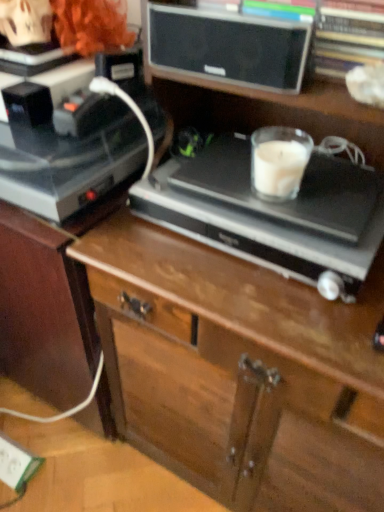
Question: From the image's perspective, is wooden chest of drawers at center above or below shiny black record player at left, which is the second appliance from right to left?

Choices:
 (A) below
 (B) above

Answer: (A)

Question: Relative to shiny black record player at left, which is the second appliance from right to left, is wooden chest of drawers at center in front or behind?

Choices:
 (A) front
 (B) behind

Answer: (A)

Question: Which object is positioned farthest from the white plastic electric outlet at lower left?

Choices:
 (A) satin black record player at center, positioned as the second appliance in left-to-right order
 (B) shiny black record player at left, the 1th appliance viewed from the left
 (C) wooden chest of drawers at center
 (D) matte black speaker at upper center

Answer: (D)

Question: Estimate the real-world distances between objects in this image. Which object is farther from the white plastic electric outlet at lower left?

Choices:
 (A) wooden chest of drawers at center
 (B) matte black speaker at upper center
 (C) satin black record player at center, positioned as the second appliance in left-to-right order
 (D) shiny black record player at left, which is the second appliance from right to left

Answer: (B)